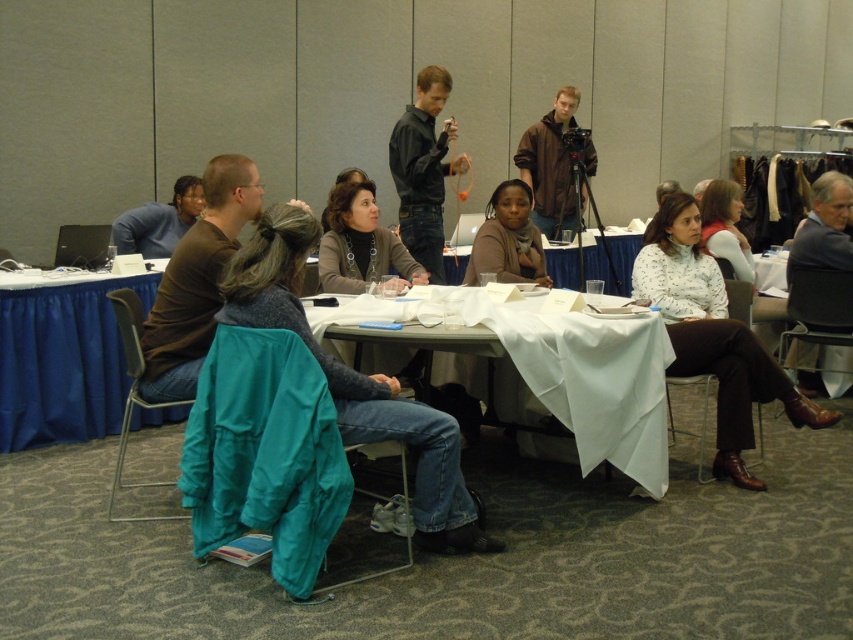
Between point (572, 333) and point (590, 252), which one is positioned in front?

Point (572, 333) is in front.

Does point (567, 445) come farther from viewer compared to point (590, 275)?

No, it is in front of (590, 275).

Identify the location of white cloth table at center. (560, 372).

Between blue fabric table at left and dark gray sweater at right, which one is positioned lower?

blue fabric table at left

In order to click on blue fabric table at left in this screenshot , I will do `click(62, 362)`.

How distant is brown leather jacket at upper center from dark gray sweater at right?

A distance of 2.13 meters exists between brown leather jacket at upper center and dark gray sweater at right.

What do you see at coordinates (550, 164) in the screenshot?
I see `brown leather jacket at upper center` at bounding box center [550, 164].

What do you see at coordinates (550, 164) in the screenshot? I see `brown leather jacket at upper center` at bounding box center [550, 164].

The image size is (853, 640). Identify the location of brown leather jacket at upper center. (550, 164).